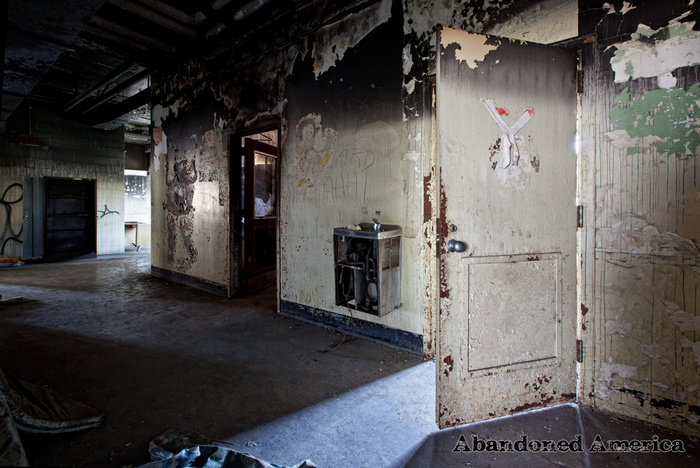
In order to click on wall in this screenshot , I will do `click(605, 185)`.